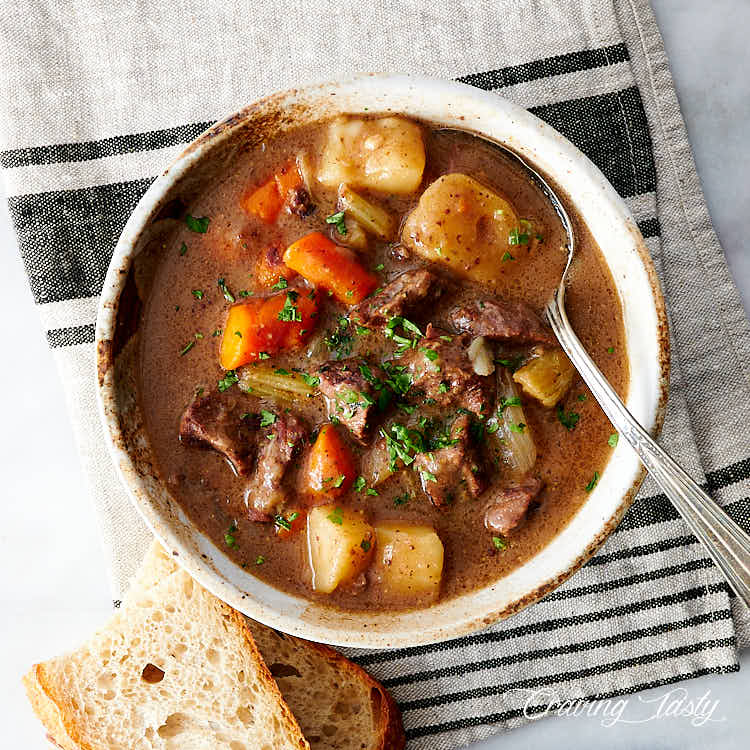
At what (x,y) coordinates should I click in order to perform the action: click on spoon  handle. Please return your answer as a coordinate pair (x, y). This screenshot has height=750, width=750. Looking at the image, I should click on (711, 540).